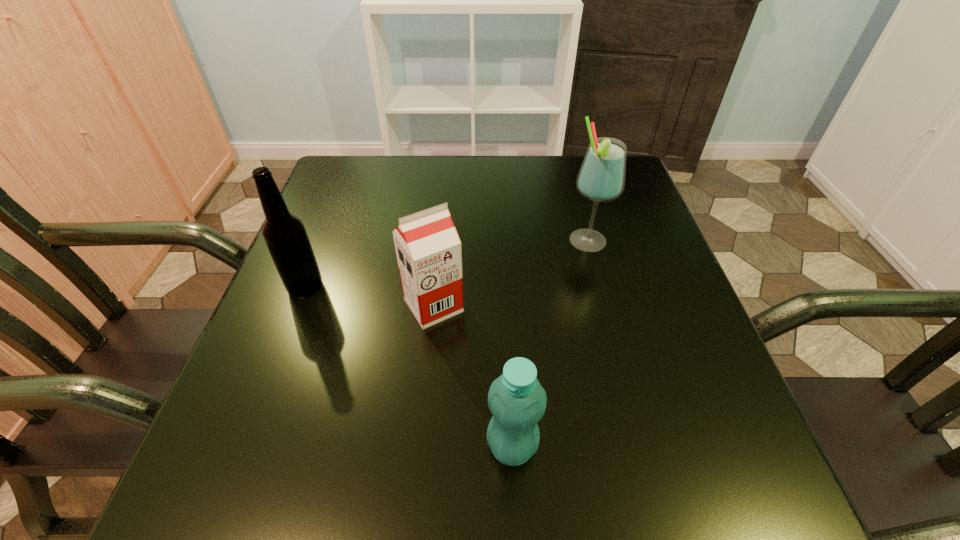
The height and width of the screenshot is (540, 960). In order to click on free space located 0.170m at the front cap of the nearest object in this screenshot , I will do `click(372, 447)`.

Identify the location of free location located at the front cap of the nearest object. (305, 447).

At what (x,y) coordinates should I click in order to perform the action: click on object located at the near edge. Please return your answer as a coordinate pair (x, y). Image resolution: width=960 pixels, height=540 pixels. Looking at the image, I should click on (516, 399).

You are a GUI agent. You are given a task and a screenshot of the screen. Output one action in this format:
    pyautogui.click(x=<x>, y=<y>)
    Task: Click on the object that is at the left edge
    The height and width of the screenshot is (540, 960).
    Given the screenshot: What is the action you would take?
    pyautogui.click(x=286, y=238)

Find the location of a particular element. The width and height of the screenshot is (960, 540). object located in the right edge section of the desktop is located at coordinates (601, 178).

Image resolution: width=960 pixels, height=540 pixels. In the image, there is a desktop. Find the location of `vacant space at the far edge`. vacant space at the far edge is located at coordinates (417, 179).

Locate an element on the screen. This screenshot has height=540, width=960. vacant space at the left edge of the desktop is located at coordinates (324, 315).

This screenshot has width=960, height=540. In the image, there is a desktop. Identify the location of vacant space at the right edge. (684, 298).

This screenshot has height=540, width=960. Find the location of `free space at the far left corner`. free space at the far left corner is located at coordinates (348, 186).

I want to click on free space between the soya milk and the leftmost object, so click(370, 296).